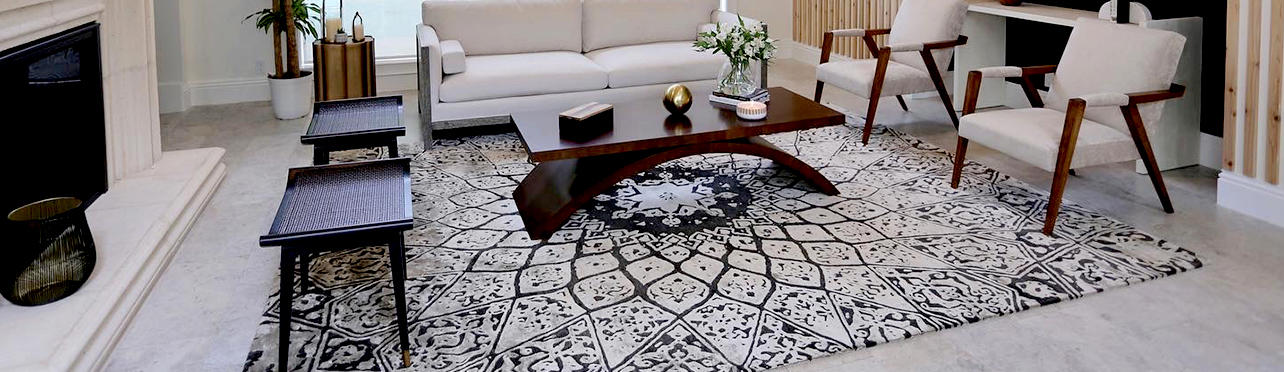
Locate an element on the screen. The height and width of the screenshot is (372, 1284). seating is located at coordinates (592, 55), (369, 118), (358, 188), (877, 62), (1039, 137).